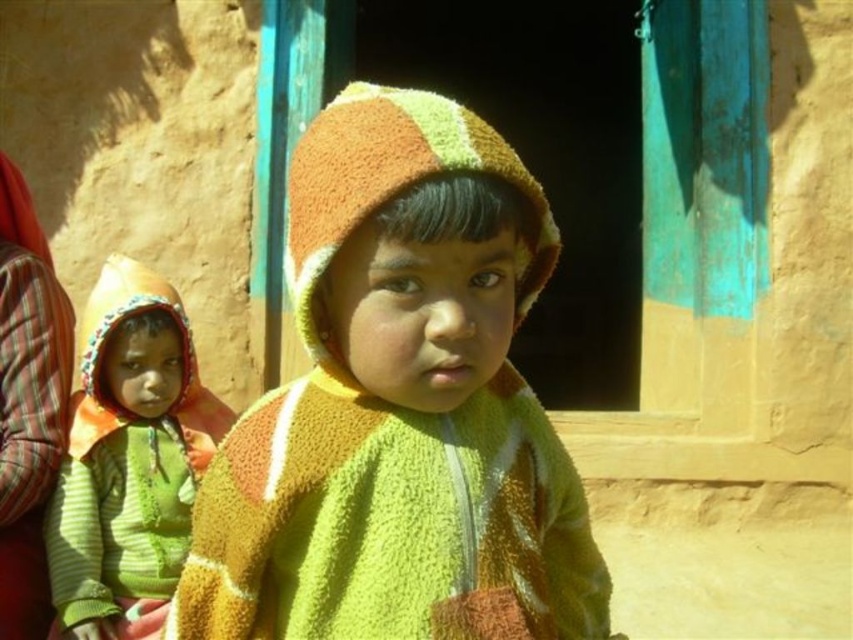
Question: Does fluffy fleece jacket at center have a smaller size compared to green striped fabric at left?

Choices:
 (A) no
 (B) yes

Answer: (B)

Question: Which point is closer to the camera?

Choices:
 (A) (334, 186)
 (B) (193, 396)

Answer: (A)

Question: Can you confirm if fluffy fleece jacket at center is bigger than green striped sweater at left?

Choices:
 (A) no
 (B) yes

Answer: (A)

Question: Which object is closer to the camera taking this photo?

Choices:
 (A) green striped sweater at left
 (B) fluffy fleece jacket at center
 (C) green striped fabric at left

Answer: (B)

Question: In this image, where is green striped sweater at left located relative to green striped fabric at left?

Choices:
 (A) above
 (B) below

Answer: (B)

Question: Which point is farther to the camera?

Choices:
 (A) green striped fabric at left
 (B) green striped sweater at left
 (C) fluffy fleece jacket at center

Answer: (A)